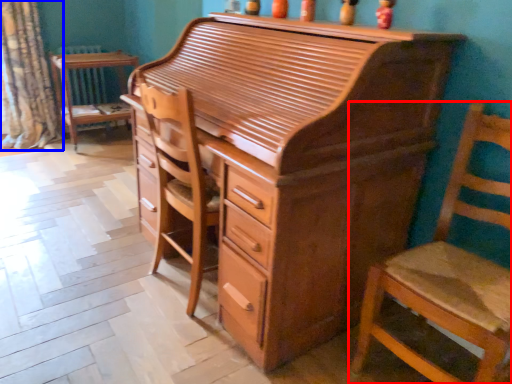
Question: Which object appears farthest to the camera in this image, chair (highlighted by a red box) or curtain (highlighted by a blue box)?

Choices:
 (A) chair
 (B) curtain

Answer: (B)